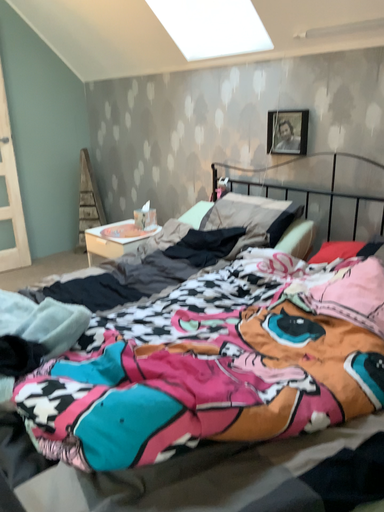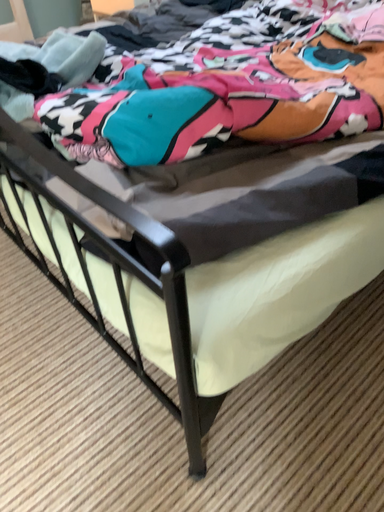
Question: Which way did the camera rotate in the video?

Choices:
 (A) rotated downward
 (B) rotated upward

Answer: (A)